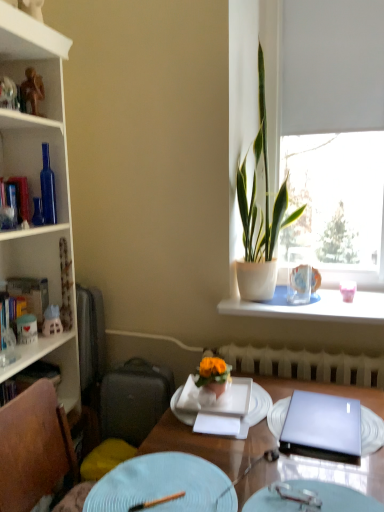
This screenshot has width=384, height=512. I want to click on free point above white ceramic vase at upper right (from a real-world perspective), so click(x=321, y=298).